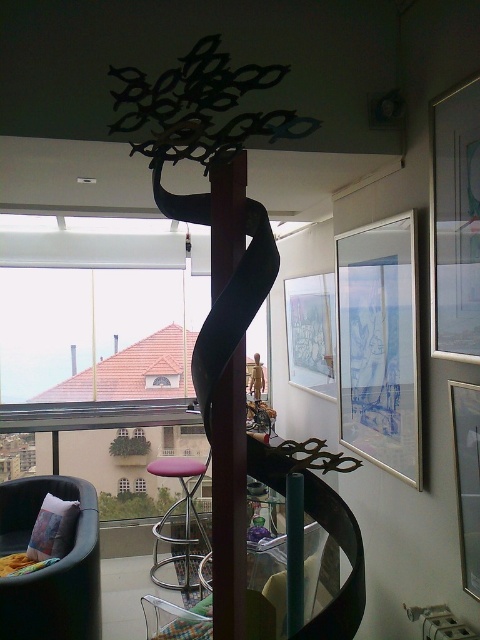
You are an interior designer working on a layout for this room. You need to place a new decorative item exactly at the center of the room. The center is defined as the point with coordinates closest to the midpoint between the sculpture and the matte glass picture frame at upper right. Where should you place the new item?

The midpoint between the sculpture and the matte glass picture frame at upper right would be calculated by averaging their coordinates. Since the sculpture is at the center of the room and the picture frame is at point (455, 225), the midpoint would be approximately halfway between these two points. However, without the exact coordinates of the sculpture, we can estimate that placing the new item near the central area of the room, balancing the sculpture and the picture frame, would be appropriate.

You are sitting in the velvet green armchair at lower left and want to reach the metallic silver picture frame at right to adjust its position. Can you easily reach it from your current position without moving from the chair?

The velvet green armchair at lower left is further to the viewer than the metallic silver picture frame at right, so the metallic silver picture frame at right is farther away. Therefore, you cannot easily reach it from your current position without moving from the chair.

You are an interior designer planning to hang two picture frames on the wall. You have the matte glass picture frame at upper right and the metallic silver picture frame at right. Based on their sizes, which one should you place higher up to maintain visual balance?

The matte glass picture frame at upper right is bigger than the metallic silver picture frame at right, so placing the larger matte glass picture frame at upper right higher up will help maintain visual balance as larger objects are typically placed higher to balance with smaller ones below.